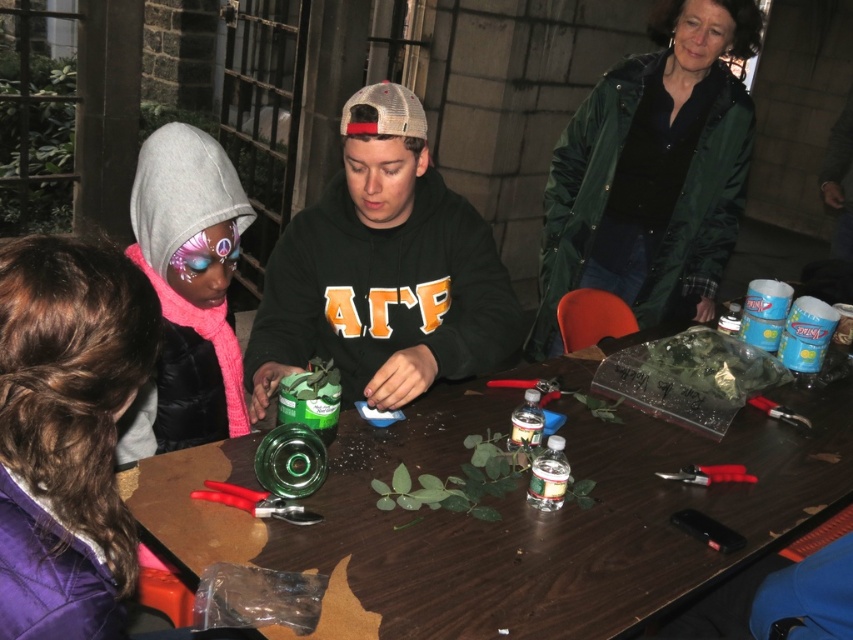
Does brown wooden table at center come in front of matte pink scarf at lower left?

Yes, it is.

Does point (701, 440) come behind point (173, 339)?

Yes, it is behind point (173, 339).

Between point (773, 518) and point (177, 147), which one is positioned in front?

Point (177, 147) is in front.

You are a GUI agent. You are given a task and a screenshot of the screen. Output one action in this format:
    pyautogui.click(x=<x>, y=<y>)
    Task: Click on the brown wooden table at center
    
    Given the screenshot: What is the action you would take?
    pyautogui.click(x=514, y=516)

Can you confirm if brown wooden table at center is positioned above green matte sweatshirt at upper right?

Incorrect, brown wooden table at center is not positioned above green matte sweatshirt at upper right.

Is point (485, 625) closer to camera compared to point (711, 109)?

Yes, it is.

The image size is (853, 640). In order to click on brown wooden table at center in this screenshot , I will do `click(514, 516)`.

Does point (169, 134) come farther from viewer compared to point (711, 260)?

No.

Can you confirm if matte pink scarf at lower left is smaller than green matte sweatshirt at upper right?

Yes, matte pink scarf at lower left is smaller than green matte sweatshirt at upper right.

Is point (231, 406) positioned in front of point (723, 109)?

Yes, point (231, 406) is in front of point (723, 109).

Find the location of a particular element. The image size is (853, 640). matte pink scarf at lower left is located at coordinates (189, 284).